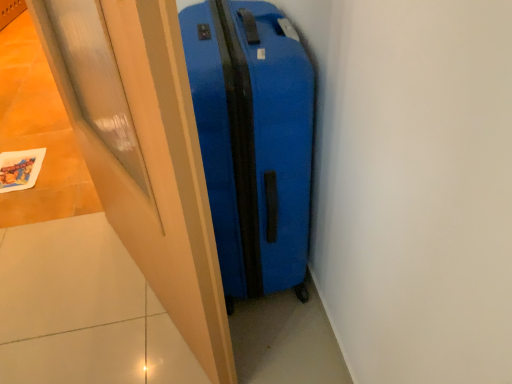
Question: From the image's perspective, relative to matte wood door at center, is blue matte suitcase at center above or below?

Choices:
 (A) below
 (B) above

Answer: (B)

Question: Considering the positions of blue matte suitcase at center and matte wood door at center in the image, is blue matte suitcase at center bigger or smaller than matte wood door at center?

Choices:
 (A) big
 (B) small

Answer: (A)

Question: Visually, is blue matte suitcase at center positioned to the left or to the right of matte wood door at center?

Choices:
 (A) left
 (B) right

Answer: (B)

Question: Is matte wood door at center to the left or to the right of blue matte suitcase at center in the image?

Choices:
 (A) right
 (B) left

Answer: (B)

Question: Is matte wood door at center in front of or behind blue matte suitcase at center in the image?

Choices:
 (A) front
 (B) behind

Answer: (A)

Question: Is point (216, 299) closer or farther from the camera than point (242, 271)?

Choices:
 (A) farther
 (B) closer

Answer: (B)

Question: Is matte wood door at center situated inside blue matte suitcase at center or outside?

Choices:
 (A) inside
 (B) outside

Answer: (B)